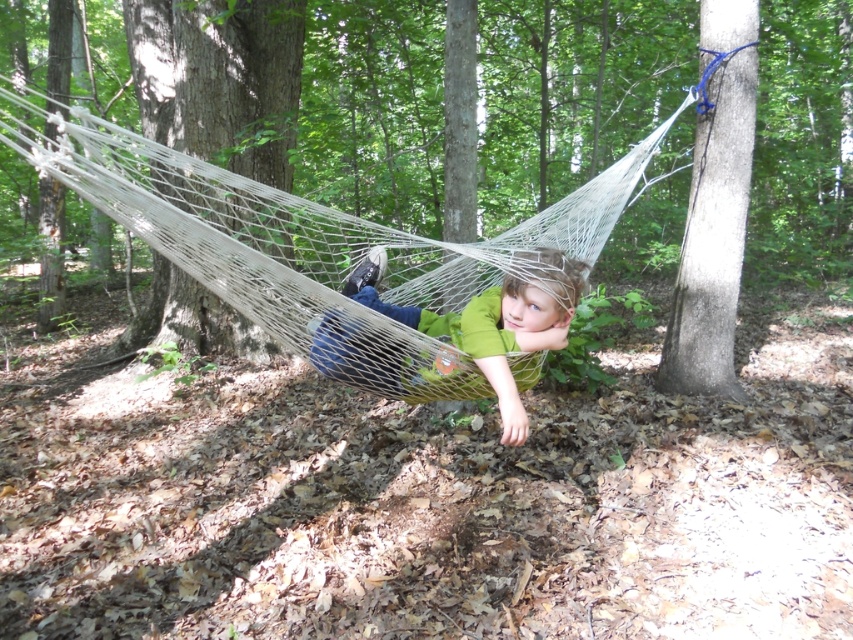
You are a painter standing in the woods and want to paint the smooth gray bark at upper right and the green fabric child at center. Which object should you focus on first if you want to paint the thinner one first?

The smooth gray bark at upper right is thinner than the green fabric child at center, so you should focus on painting the smooth gray bark at upper right first.

You are a hiker who wants to take a photo of both the brown rough tree at center and the smooth gray bark at upper right. Which tree should you stand closer to in order to capture both in the same frame?

You should stand closer to the brown rough tree at center because it is positioned on the left side of the smooth gray bark at upper right, allowing both trees to be included in the same frame when moving closer to the left one.